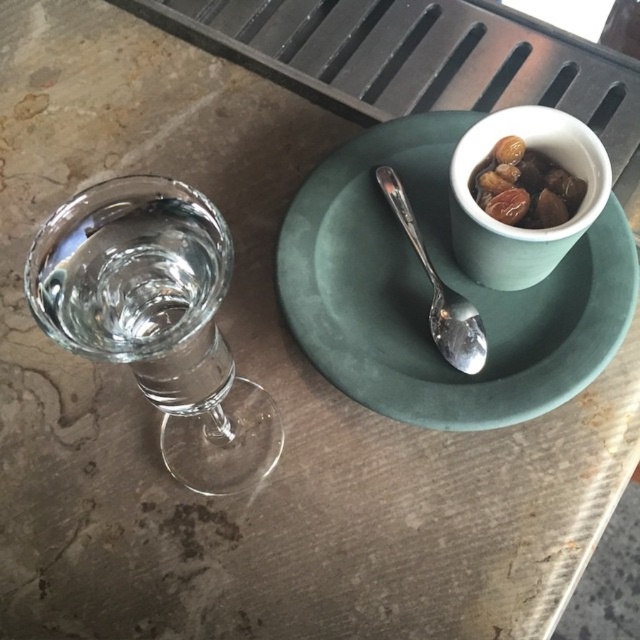
Question: Which point is closer to the camera?

Choices:
 (A) (472, 150)
 (B) (396, 266)
 (C) (244, 438)
 (D) (497, 173)

Answer: (A)

Question: Which object is positioned farthest from the white matte cup at upper right?

Choices:
 (A) green matte plate at center
 (B) satin silver spoon at center
 (C) transparent glass at left

Answer: (C)

Question: Is green matte plate at center behind brown matte nuts at upper right?

Choices:
 (A) yes
 (B) no

Answer: (A)

Question: Is green matte plate at center bigger than transparent glass at left?

Choices:
 (A) no
 (B) yes

Answer: (B)

Question: Which object is the farthest from the green matte plate at center?

Choices:
 (A) brown matte nuts at upper right
 (B) white matte cup at upper right
 (C) satin silver spoon at center

Answer: (A)

Question: Is white matte cup at upper right positioned before brown matte nuts at upper right?

Choices:
 (A) no
 (B) yes

Answer: (B)